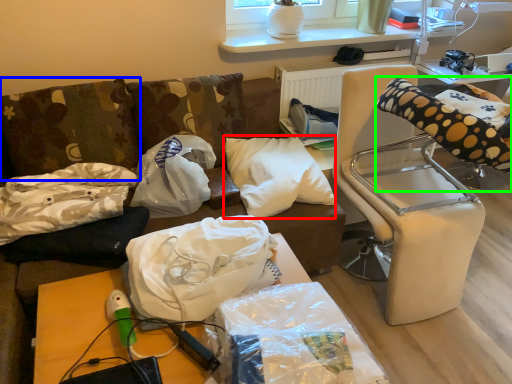
Question: Which object is the closest to the pillow (highlighted by a red box)? Choose among these: pillow (highlighted by a blue box) or bean bag chair (highlighted by a green box).

Choices:
 (A) pillow
 (B) bean bag chair

Answer: (B)